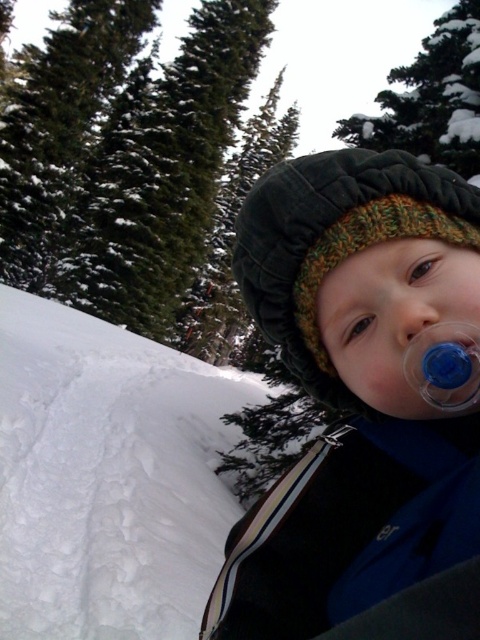
You are a photographer trying to capture the child in the winter scene. You notice the knitted woolen hat at center and the matte plastic nose at center. Which object should you focus on first if you want to ensure both are in sharp focus?

You should focus on the knitted woolen hat at center first because it is positioned to the right of the matte plastic nose at center, making it farther away. By focusing on the farther object, you can ensure both are within the depth of field.

You are a toy designer observing the child in the winter scene. You need to create a pacifier that fits comfortably in the child mouth. Given the blue rubber pacifier at center and the matte plastic nose at center, which object has a larger width that you should consider for the pacifier design?

The blue rubber pacifier at center has a larger width than the matte plastic nose at center, so the pacifier design should be adjusted to match the size of the blue rubber pacifier at center to ensure a comfortable fit.

You are a photographer taking a closeup shot of the child in the winter scene. You notice the blue rubber pacifier at center and the knitted woolen hat at center. Which object is located to the left of the other?

The blue rubber pacifier at center is positioned on the left side of knitted woolen hat at center.